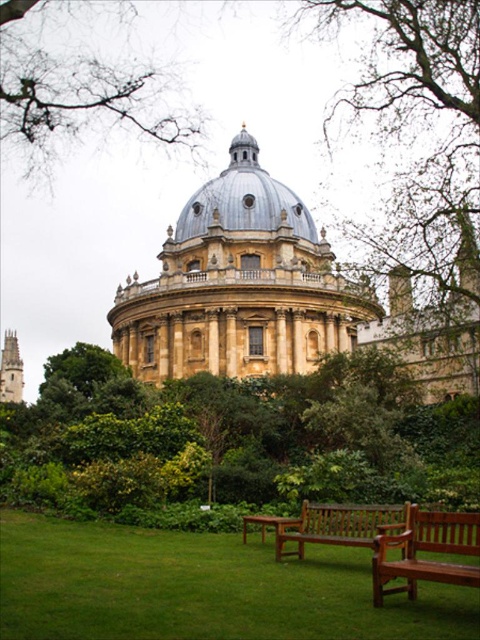
You are standing in front of the grand classical building and see the green leafy tree at center and the brown leafy tree at upper center. Which tree is positioned to the right of the other?

The green leafy tree at center is positioned to the right of the brown leafy tree at upper center.

You are planning to take a photo of the brown leafy tree at upper center and the mahogany wood bench at lower right from a position where both are visible. Considering their potential widths, which object might require you to adjust your camera angle to ensure both are fully in frame?

The brown leafy tree at upper center might be wider than the mahogany wood bench at lower right, so adjusting the camera angle to accommodate its width would be necessary to ensure both are fully visible in the photo.

You are standing at the entrance of the grand classical building facing the dome. There is a point marked at coordinates (255, 428) in the image. What object is located at this point?

The point at coordinates (255, 428) corresponds to a green leafy tree at center.